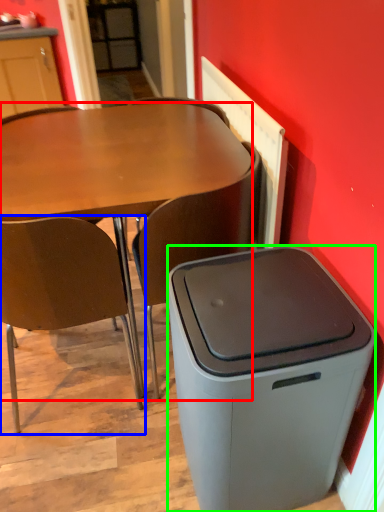
Question: Based on their relative distances, which object is nearer to desk (highlighted by a red box)? Choose from chair (highlighted by a blue box) and trash bin/can (highlighted by a green box).

Choices:
 (A) chair
 (B) trash bin/can

Answer: (A)